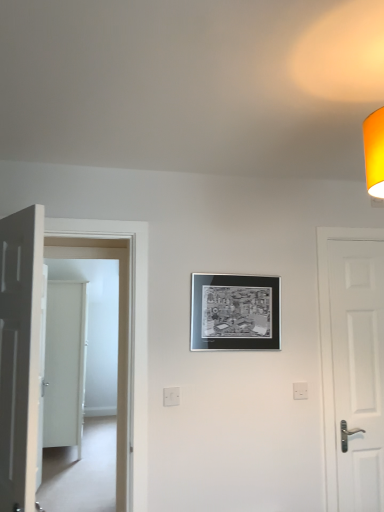
Question: Should I look upward or downward to see white glossy door at left, the 2th door in the front-to-back sequence?

Choices:
 (A) up
 (B) down

Answer: (B)

Question: Which direction should I rotate to face white plastic electric outlet at lower center, the 2th electric outlet when ordered from left to right, — up or down?

Choices:
 (A) up
 (B) down

Answer: (B)

Question: Does white glossy door at left, positioned as the third door in left-to-right order, have a smaller size compared to metallic silver picture frame at center?

Choices:
 (A) no
 (B) yes

Answer: (A)

Question: Is white glossy door at left, the 2th door when ordered from right to left, turned away from metallic silver picture frame at center?

Choices:
 (A) yes
 (B) no

Answer: (B)

Question: Considering the relative positions of white glossy door at left, positioned as the third door in left-to-right order, and metallic silver picture frame at center in the image provided, is white glossy door at left, positioned as the third door in left-to-right order, to the right of metallic silver picture frame at center from the viewer's perspective?

Choices:
 (A) no
 (B) yes

Answer: (A)

Question: From the image's perspective, is white glossy door at left, the 2th door when ordered from right to left, located beneath metallic silver picture frame at center?

Choices:
 (A) yes
 (B) no

Answer: (A)

Question: Is white glossy door at left, positioned as the third door in left-to-right order, shorter than metallic silver picture frame at center?

Choices:
 (A) no
 (B) yes

Answer: (A)

Question: Is white glossy door at left, positioned as the third door in left-to-right order, to the left of metallic silver picture frame at center from the viewer's perspective?

Choices:
 (A) yes
 (B) no

Answer: (A)

Question: Considering the relative positions of white matte door at left, placed as the second door when sorted from left to right, and metallic silver picture frame at center in the image provided, is white matte door at left, placed as the second door when sorted from left to right, to the right of metallic silver picture frame at center from the viewer's perspective?

Choices:
 (A) no
 (B) yes

Answer: (A)

Question: Is white matte door at left, which is counted as the third door, starting from the right, bigger than metallic silver picture frame at center?

Choices:
 (A) yes
 (B) no

Answer: (A)

Question: From a real-world perspective, does white matte door at left, the 4th door positioned from the back, sit lower than metallic silver picture frame at center?

Choices:
 (A) yes
 (B) no

Answer: (A)

Question: Is white matte door at left, placed as the second door when sorted from left to right, at the left side of metallic silver picture frame at center?

Choices:
 (A) yes
 (B) no

Answer: (A)

Question: Is there a large distance between white matte door at left, the 4th door positioned from the back, and metallic silver picture frame at center?

Choices:
 (A) no
 (B) yes

Answer: (B)

Question: Is white matte door at left, which is counted as the third door, starting from the right, completely or partially outside of metallic silver picture frame at center?

Choices:
 (A) yes
 (B) no

Answer: (A)

Question: Is white plastic electric outlet at center, positioned as the second electric outlet in back-to-front order, wider than white glossy door at left, the 2th door in the front-to-back sequence?

Choices:
 (A) no
 (B) yes

Answer: (A)